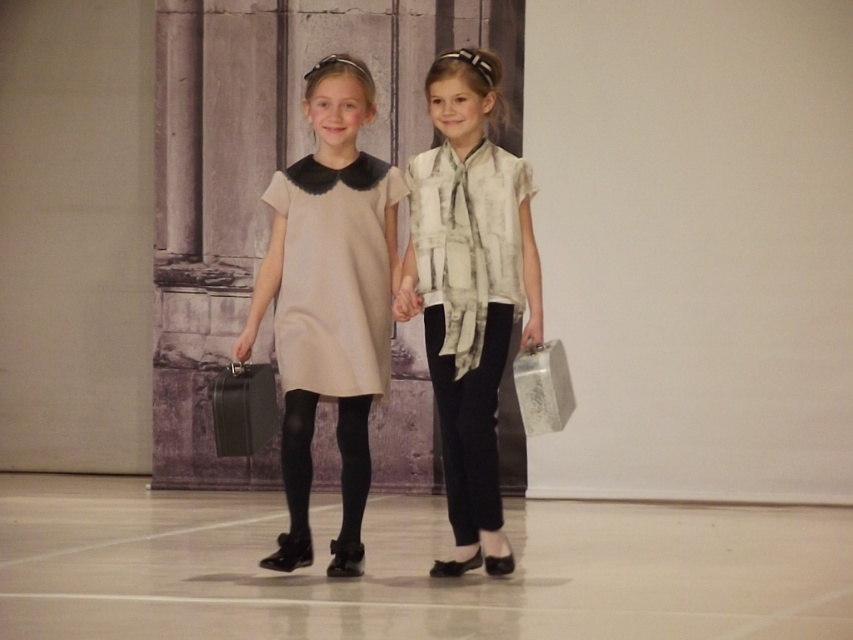
Question: Is matte beige dress at center further to camera compared to white printed blouse at center?

Choices:
 (A) yes
 (B) no

Answer: (B)

Question: Which point is closer to the camera?

Choices:
 (A) (358, 272)
 (B) (471, 451)
 (C) (486, 472)
 (D) (532, 372)

Answer: (D)

Question: Does matte beige dress at center appear on the left side of beige matte dress at center?

Choices:
 (A) no
 (B) yes

Answer: (B)

Question: Among these points, which one is farthest from the camera?

Choices:
 (A) (442, 360)
 (B) (561, 374)
 (C) (312, 296)
 (D) (503, 211)

Answer: (B)

Question: Is beige matte dress at center behind metallic silver briefcase at right?

Choices:
 (A) yes
 (B) no

Answer: (A)

Question: Which object is farther from the camera taking this photo?

Choices:
 (A) black smooth pants at center
 (B) matte beige dress at center
 (C) metallic silver briefcase at right

Answer: (A)